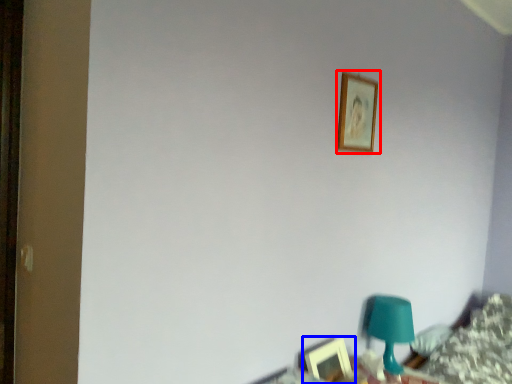
Question: Which object appears farthest to the camera in this image, picture frame (highlighted by a red box) or picture frame (highlighted by a blue box)?

Choices:
 (A) picture frame
 (B) picture frame

Answer: (A)